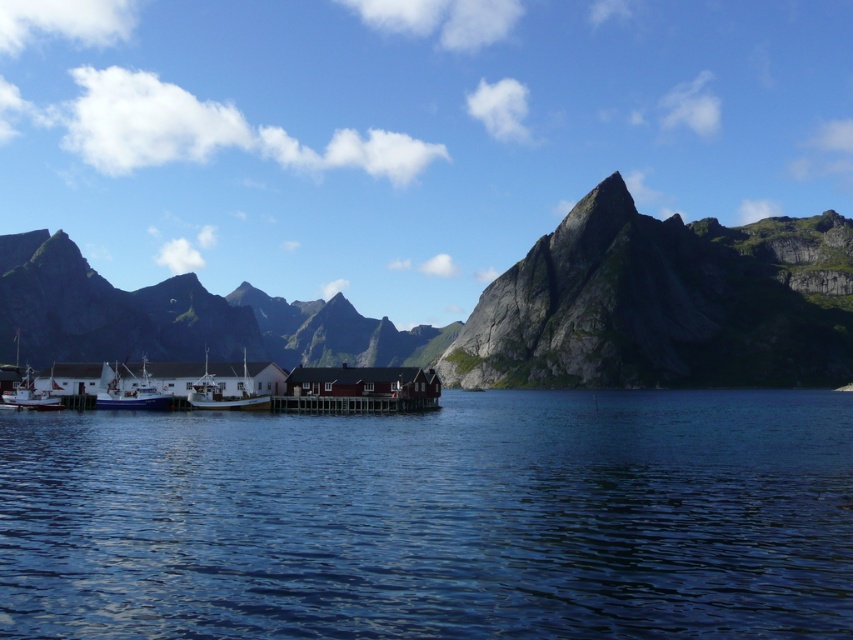
Looking at this image, who is higher up, rugged granite mountain at center or white matte boat at lower left?

rugged granite mountain at center is above.

Is rugged granite mountain at center closer to the viewer compared to white matte boat at lower left?

No, it is not.

Is point (192, 332) farther from camera compared to point (151, 385)?

Yes, it is.

Where is `rugged granite mountain at center`? rugged granite mountain at center is located at coordinates (500, 307).

Is blue water at center to the right of rugged granite mountain at center from the viewer's perspective?

Indeed, blue water at center is positioned on the right side of rugged granite mountain at center.

You are a GUI agent. You are given a task and a screenshot of the screen. Output one action in this format:
    pyautogui.click(x=<x>, y=<y>)
    Task: Click on the blue water at center
    The height and width of the screenshot is (640, 853).
    Given the screenshot: What is the action you would take?
    pyautogui.click(x=434, y=518)

Which is behind, point (207, 401) or point (32, 401)?

The point (32, 401) is behind.

Does white matte boat at center appear on the right side of white wooden boat at lower left?

In fact, white matte boat at center is to the left of white wooden boat at lower left.

Image resolution: width=853 pixels, height=640 pixels. What do you see at coordinates (223, 394) in the screenshot?
I see `white matte boat at center` at bounding box center [223, 394].

Locate an element on the screen. white matte boat at center is located at coordinates (223, 394).